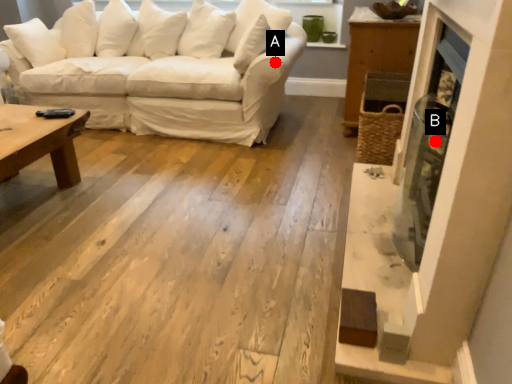
Question: Two points are circled on the image, labeled by A and B beside each circle. Among these points, which one is nearest to the camera?

Choices:
 (A) A is closer
 (B) B is closer

Answer: (B)